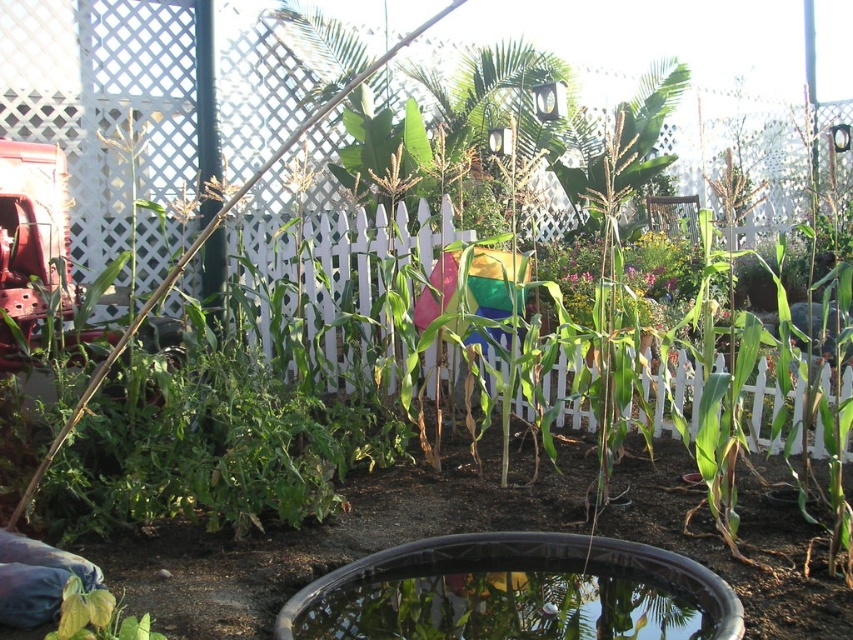
Who is positioned more to the right, black rubber fish pond at lower center or green leafy plant at lower left?

black rubber fish pond at lower center

Does black rubber fish pond at lower center have a greater height compared to green leafy plant at lower left?

In fact, black rubber fish pond at lower center may be shorter than green leafy plant at lower left.

At what (x,y) coordinates should I click in order to perform the action: click on black rubber fish pond at lower center. Please return your answer as a coordinate pair (x, y). Looking at the image, I should click on (515, 593).